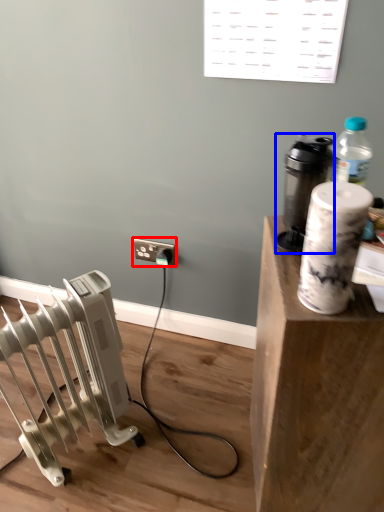
Question: Which object appears farthest to the camera in this image, electric outlet (highlighted by a red box) or appliance (highlighted by a blue box)?

Choices:
 (A) electric outlet
 (B) appliance

Answer: (A)